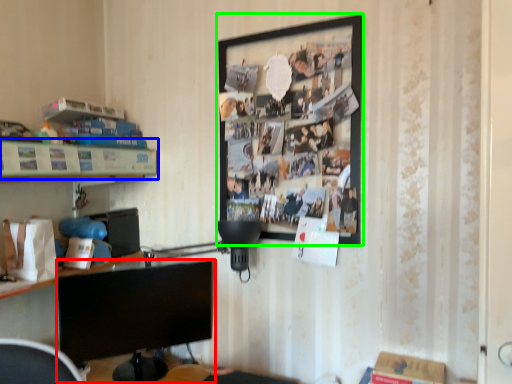
Question: Considering the real-world distances, which object is farthest from computer monitor (highlighted by a red box)? shelf (highlighted by a blue box) or picture frame (highlighted by a green box)?

Choices:
 (A) shelf
 (B) picture frame

Answer: (B)